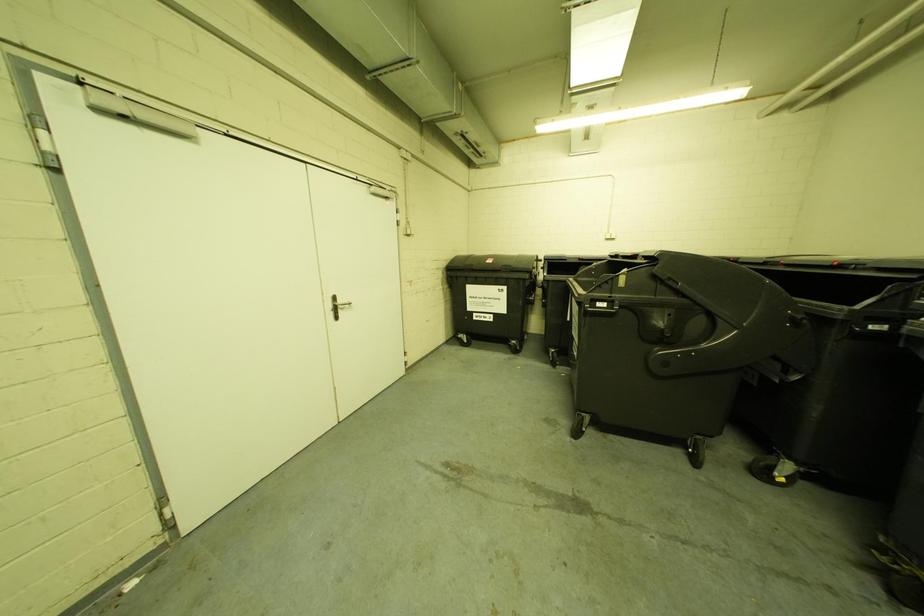
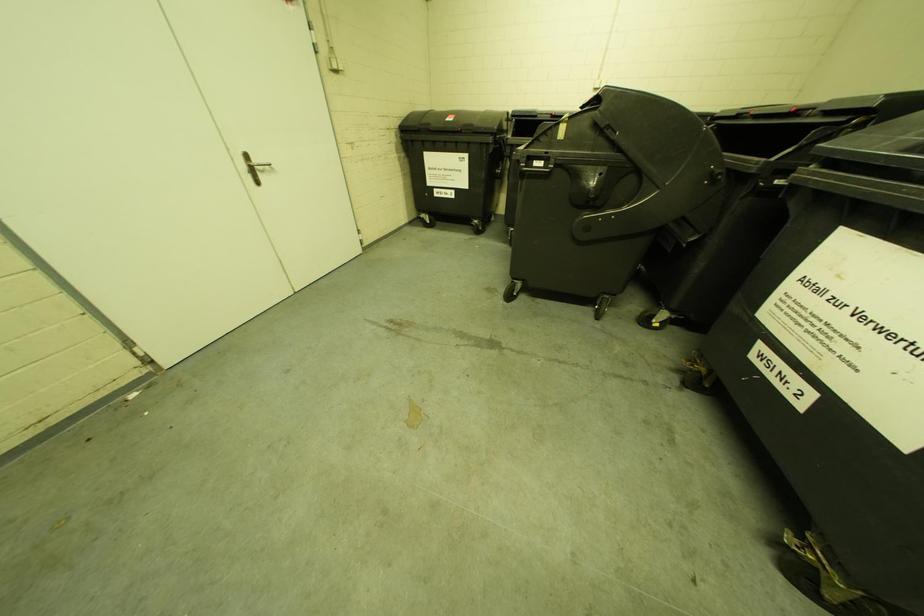
Question: Which direction would the cameraman need to move to produce the second image? Reply with the corresponding letter.

Choices:
 (A) Left
 (B) Right
 (C) Forward
 (D) Backward

Answer: (B)